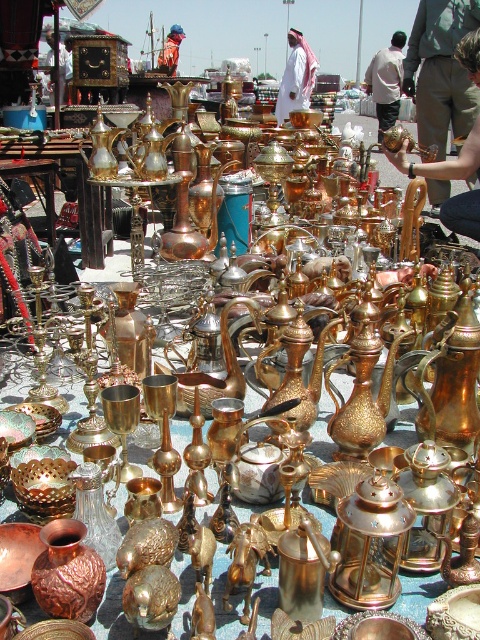
Can you confirm if matte gold teapot at center is shorter than white matte clothing at center?

Indeed, matte gold teapot at center has a lesser height compared to white matte clothing at center.

Is point (388, 154) positioned after point (296, 88)?

That is False.

Who is more distant from viewer, [472,234] or [300,33]?

The point [300,33] is more distant.

Where is `matte gold teapot at center`? The height and width of the screenshot is (640, 480). matte gold teapot at center is located at coordinates (443, 161).

Can you confirm if matte gold teapot at center is shorter than white fabric shirt at upper center?

Indeed, matte gold teapot at center has a lesser height compared to white fabric shirt at upper center.

Who is more distant from viewer, (470, 52) or (398, 88)?

The point (398, 88) is more distant.

This screenshot has height=640, width=480. In order to click on matte gold teapot at center in this screenshot , I will do `click(443, 161)`.

Between point (286, 97) and point (66, 60), which one is positioned in front?

Point (66, 60) is in front.

This screenshot has height=640, width=480. What do you see at coordinates (296, 76) in the screenshot?
I see `white matte clothing at center` at bounding box center [296, 76].

Locate an element on the screen. white matte clothing at center is located at coordinates (296, 76).